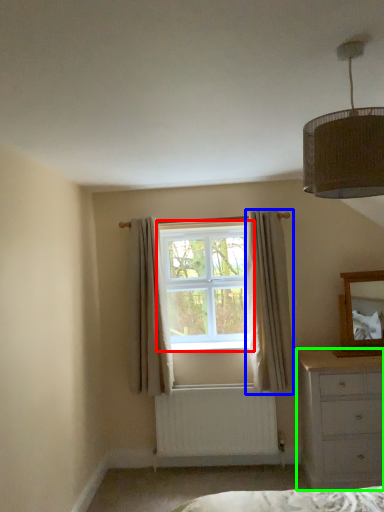
Question: Based on their relative distances, which object is nearer to window (highlighted by a red box)? Choose from curtain (highlighted by a blue box) and chest of drawers (highlighted by a green box).

Choices:
 (A) curtain
 (B) chest of drawers

Answer: (A)